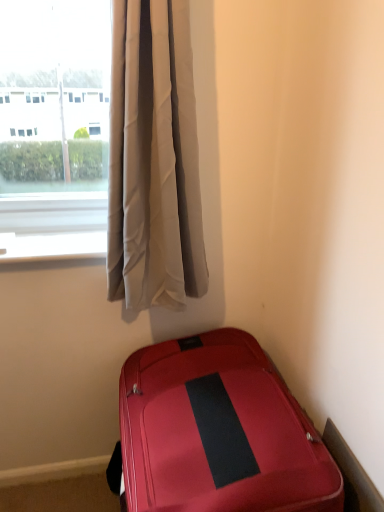
Measure the distance between point (142, 23) and camera.

Point (142, 23) is 3.81 feet away from camera.

The image size is (384, 512). What do you see at coordinates (153, 159) in the screenshot?
I see `silky white curtains at upper left` at bounding box center [153, 159].

Locate an element on the screen. silky white curtains at upper left is located at coordinates (153, 159).

Identify the location of shiny red suitcase at lower right. (217, 432).

Consider the image. Measure the distance between point (247, 390) and camera.

3.87 feet.

Image resolution: width=384 pixels, height=512 pixels. What do you see at coordinates (217, 432) in the screenshot? I see `shiny red suitcase at lower right` at bounding box center [217, 432].

Where is `silky white curtains at upper left`? silky white curtains at upper left is located at coordinates (153, 159).

Looking at this image, which object is positioned more to the right, silky white curtains at upper left or shiny red suitcase at lower right?

shiny red suitcase at lower right.

Does silky white curtains at upper left come behind shiny red suitcase at lower right?

Yes, silky white curtains at upper left is further from the viewer.

Is point (153, 131) behind point (241, 471)?

Yes, point (153, 131) is behind point (241, 471).

From the image's perspective, is silky white curtains at upper left on shiny red suitcase at lower right?

Correct, silky white curtains at upper left appears higher than shiny red suitcase at lower right in the image.

From a real-world perspective, is silky white curtains at upper left positioned above or below shiny red suitcase at lower right?

In terms of real-world spatial position, silky white curtains at upper left is above shiny red suitcase at lower right.

Based on the photo, which object is wider, silky white curtains at upper left or shiny red suitcase at lower right?

shiny red suitcase at lower right.

Does silky white curtains at upper left have a greater height compared to shiny red suitcase at lower right?

Correct, silky white curtains at upper left is much taller as shiny red suitcase at lower right.

Considering the relative sizes of silky white curtains at upper left and shiny red suitcase at lower right in the image provided, is silky white curtains at upper left smaller than shiny red suitcase at lower right?

Yes.

Based on the photo, do you think silky white curtains at upper left is within shiny red suitcase at lower right, or outside of it?

silky white curtains at upper left exists outside the volume of shiny red suitcase at lower right.

Is silky white curtains at upper left not near shiny red suitcase at lower right?

No.

Could you tell me if silky white curtains at upper left is facing shiny red suitcase at lower right?

No, silky white curtains at upper left is not turned towards shiny red suitcase at lower right.

How different are the orientations of silky white curtains at upper left and shiny red suitcase at lower right in degrees?

92 degrees separate the facing orientations of silky white curtains at upper left and shiny red suitcase at lower right.

Measure the distance from silky white curtains at upper left to shiny red suitcase at lower right.

silky white curtains at upper left is 18.33 inches away from shiny red suitcase at lower right.

Image resolution: width=384 pixels, height=512 pixels. Find the location of `suitcase that is below the silky white curtains at upper left (from the image's perspective)`. suitcase that is below the silky white curtains at upper left (from the image's perspective) is located at coordinates (217, 432).

Considering the relative positions of shiny red suitcase at lower right and silky white curtains at upper left in the image provided, is shiny red suitcase at lower right to the right of silky white curtains at upper left from the viewer's perspective?

Yes.

Is shiny red suitcase at lower right closer to camera compared to silky white curtains at upper left?

Yes, shiny red suitcase at lower right is closer to the viewer.

Between point (261, 439) and point (109, 298), which one is positioned behind?

Positioned behind is point (109, 298).

From the image's perspective, is shiny red suitcase at lower right on silky white curtains at upper left?

No.

From a real-world perspective, is shiny red suitcase at lower right physically located above or below silky white curtains at upper left?

shiny red suitcase at lower right is below silky white curtains at upper left.

In terms of width, does shiny red suitcase at lower right look wider or thinner when compared to silky white curtains at upper left?

In the image, shiny red suitcase at lower right appears to be wider than silky white curtains at upper left.

Which of these two, shiny red suitcase at lower right or silky white curtains at upper left, stands taller?

Standing taller between the two is silky white curtains at upper left.

Who is smaller, shiny red suitcase at lower right or silky white curtains at upper left?

With smaller size is silky white curtains at upper left.

Would you say shiny red suitcase at lower right is inside or outside silky white curtains at upper left?

shiny red suitcase at lower right is spatially situated outside silky white curtains at upper left.

Are shiny red suitcase at lower right and silky white curtains at upper left beside each other?

No, shiny red suitcase at lower right is not beside silky white curtains at upper left.

Is shiny red suitcase at lower right looking in the opposite direction of silky white curtains at upper left?

No.

How different are the orientations of shiny red suitcase at lower right and silky white curtains at upper left in degrees?

92 degrees.

I want to click on curtain lying above the shiny red suitcase at lower right (from the image's perspective), so click(153, 159).

Where is `curtain that appears behind the shiny red suitcase at lower right`? This screenshot has height=512, width=384. curtain that appears behind the shiny red suitcase at lower right is located at coordinates (153, 159).

I want to click on suitcase in front of the silky white curtains at upper left, so click(217, 432).